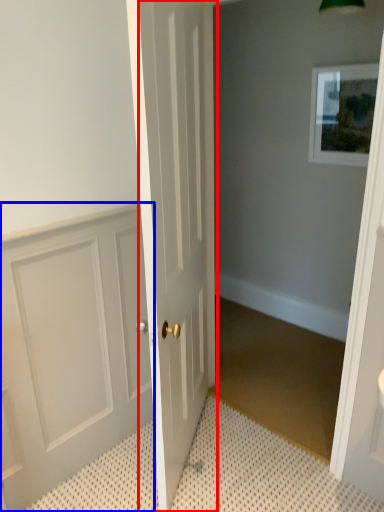
Question: Among these objects, which one is nearest to the camera, door (highlighted by a red box) or door (highlighted by a blue box)?

Choices:
 (A) door
 (B) door

Answer: (A)